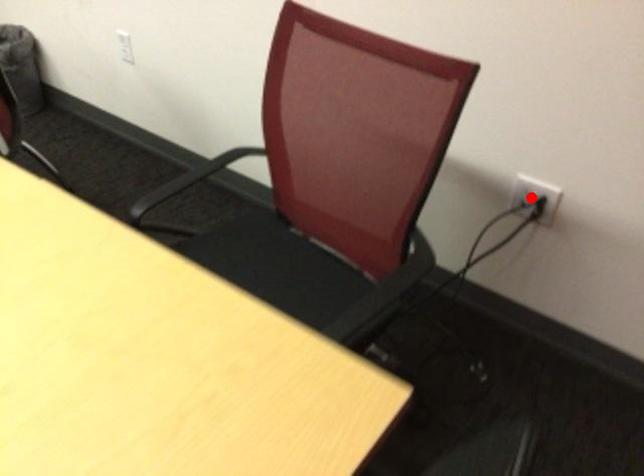
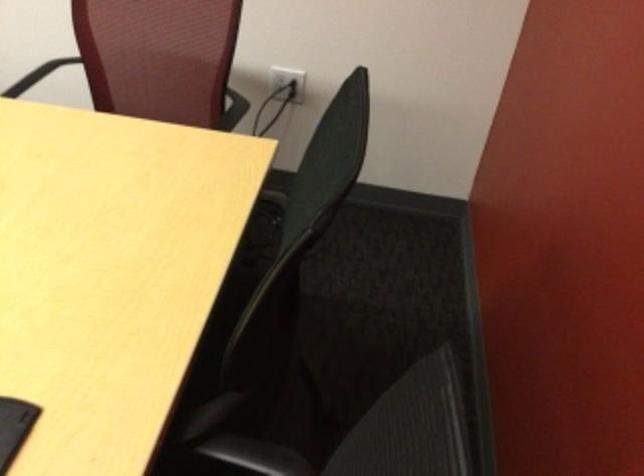
Question: I am providing you with two images of the same scene from different viewpoints. In image1, a red point is highlighted. Considering the same 3D point in image2, which of the following is correct?

Choices:
 (A) It is closer
 (B) It is farther

Answer: (B)